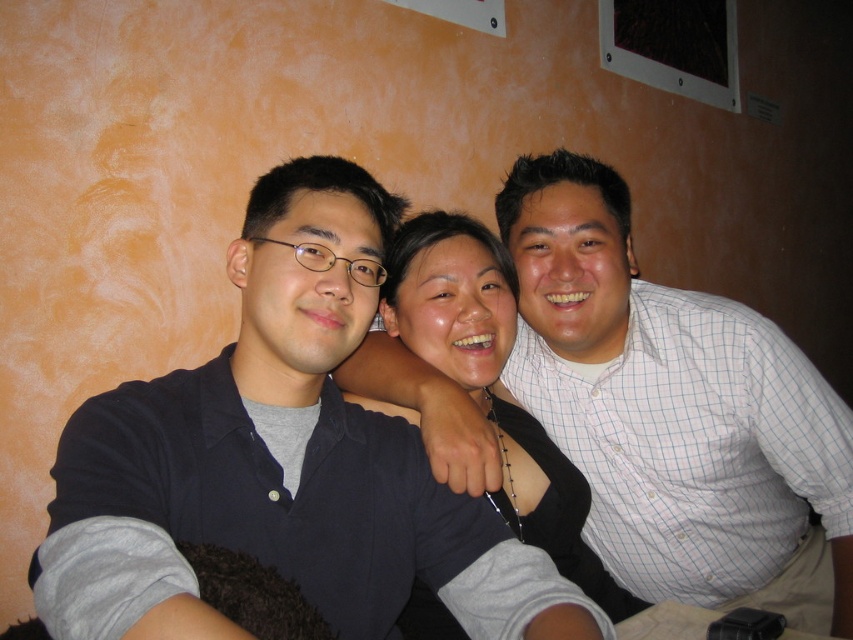
Is point (315, 356) positioned before point (473, 221)?

That is True.

Is dark blue shirt at center positioned behind matte black sweater at center?

No, it is in front of matte black sweater at center.

Locate an element on the screen. Image resolution: width=853 pixels, height=640 pixels. dark blue shirt at center is located at coordinates (282, 460).